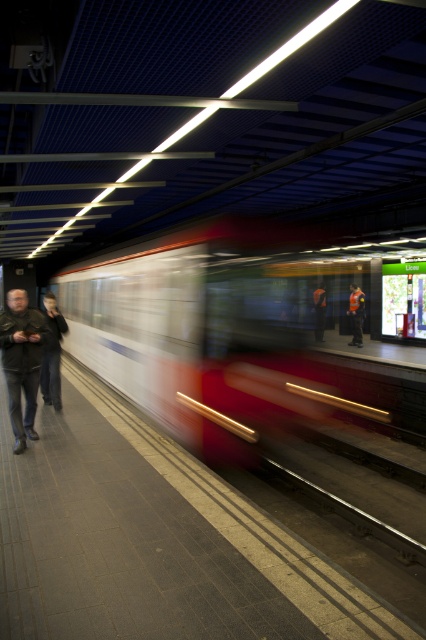
Question: Does reflective orange vest at center appear on the left side of orange reflective vest at center?

Choices:
 (A) no
 (B) yes

Answer: (A)

Question: Estimate the real-world distances between objects in this image. Which object is closer to the white glossy train at center?

Choices:
 (A) dark gray jeans at left
 (B) smooth concrete platform at center
 (C) orange reflective vest at center
 (D) reflective orange vest at center

Answer: (D)

Question: Does dark gray jeans at left appear on the right side of orange reflective vest at center?

Choices:
 (A) no
 (B) yes

Answer: (A)

Question: Is dark gray jeans at left further to the viewer compared to orange reflective vest at center?

Choices:
 (A) yes
 (B) no

Answer: (B)

Question: Which point is farther to the camera?

Choices:
 (A) white glossy train at center
 (B) reflective orange vest at center
 (C) leather jacket at left

Answer: (B)

Question: Which object is positioned farthest from the smooth concrete platform at center?

Choices:
 (A) reflective orange vest at center
 (B) orange reflective vest at center

Answer: (B)